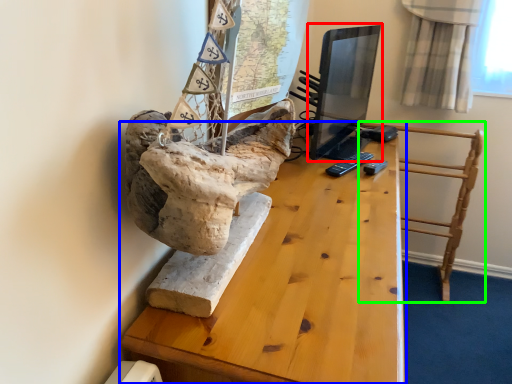
Question: Which object is positioned farthest from computer monitor (highlighted by a red box)? Select from table (highlighted by a blue box) and furniture (highlighted by a green box).

Choices:
 (A) table
 (B) furniture

Answer: (A)